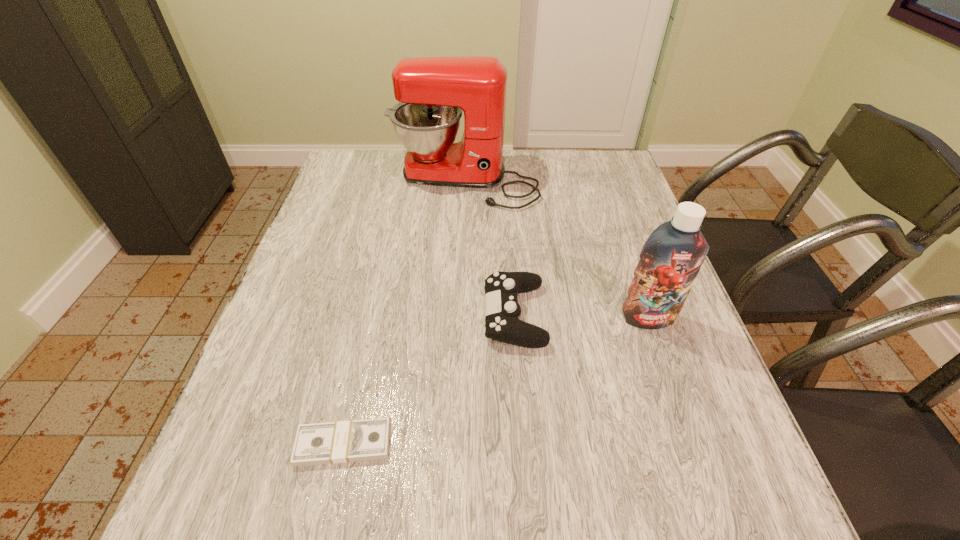
Where is `vacant point located between the third tallest object and the kitchen mixer`? vacant point located between the third tallest object and the kitchen mixer is located at coordinates click(490, 248).

The width and height of the screenshot is (960, 540). I want to click on the second closest object to the kitchen mixer, so click(671, 258).

Identify which object is the third nearest to the control. Please provide its 2D coordinates. Your answer should be formatted as a tuple, i.e. [(x, y)], where the tuple contains the x and y coordinates of a point satisfying the conditions above.

[(432, 92)]

Where is `vacant area in the image that satisfies the following two spatial constraints: 1. on the surface of the third tallest object; 2. on the front side of the dollar`? vacant area in the image that satisfies the following two spatial constraints: 1. on the surface of the third tallest object; 2. on the front side of the dollar is located at coordinates (523, 444).